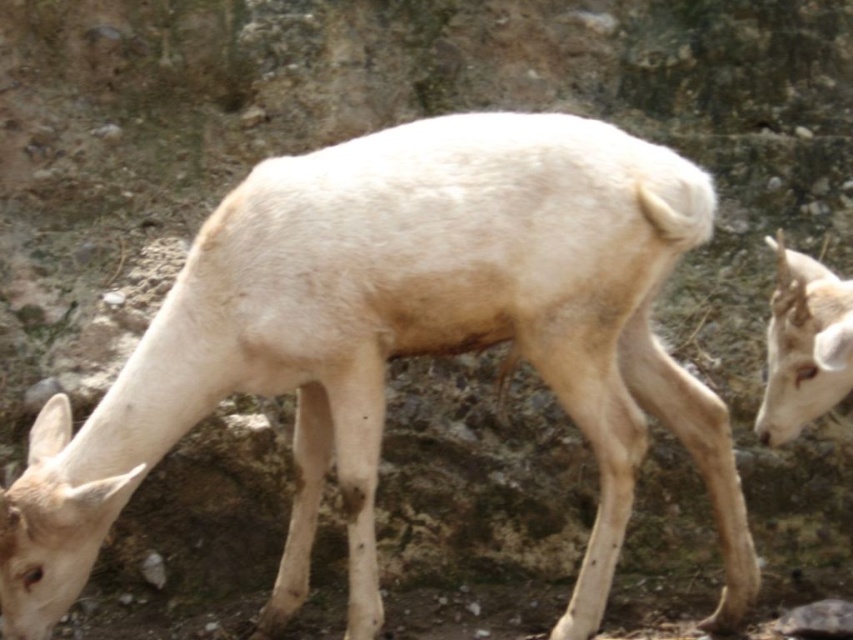
Question: Can you confirm if white woolen deer at center is smaller than white matte deer at right?

Choices:
 (A) yes
 (B) no

Answer: (B)

Question: Is white woolen deer at center bigger than white matte deer at right?

Choices:
 (A) yes
 (B) no

Answer: (A)

Question: Which point is closer to the camera?

Choices:
 (A) (708, 412)
 (B) (776, 410)

Answer: (B)

Question: Is white woolen deer at center positioned before white matte deer at right?

Choices:
 (A) yes
 (B) no

Answer: (B)